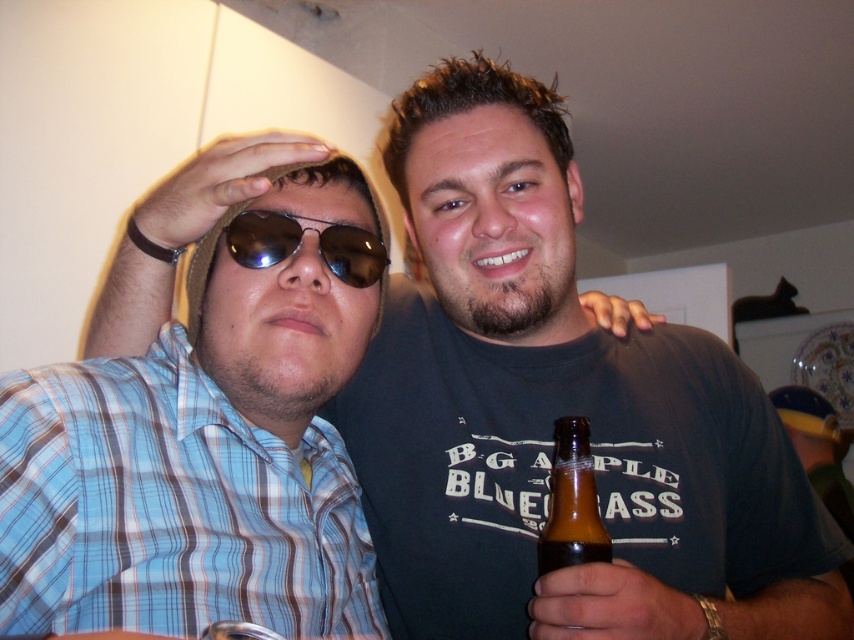
You are a photographer trying to capture a candid shot of the sunglasses at center. However, the brown glass bottle at lower right is blocking your view. Can you adjust your position to take the photo without moving the bottle?

The brown glass bottle at lower right is in front of the sunglasses at center, so you can move your camera position to the side or angle it upwards to capture the sunglasses without the bottle blocking the view.

You are a bartender who needs to grab a drink for a customer. You see the brown glass bottle at lower right and the sunglasses at center. Which object is closer to you?

The sunglasses at center is closer to you because the distance between the brown glass bottle at lower right and the sunglasses at center is 9.09 inches, so the sunglasses are nearer than the bottle.